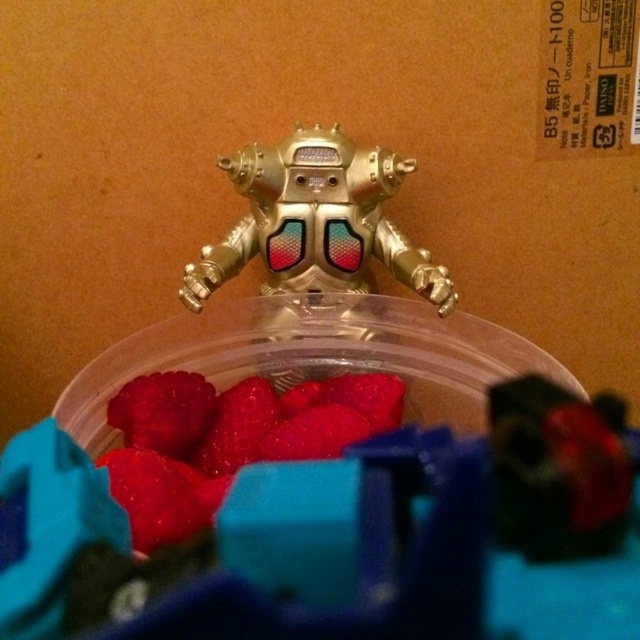
You are a child trying to reach the shiny red berries at center and the gold metallic robot at center. Which object is taller so you can grab it first?

The gold metallic robot at center is taller than the shiny red berries at center, so you can grab it first.